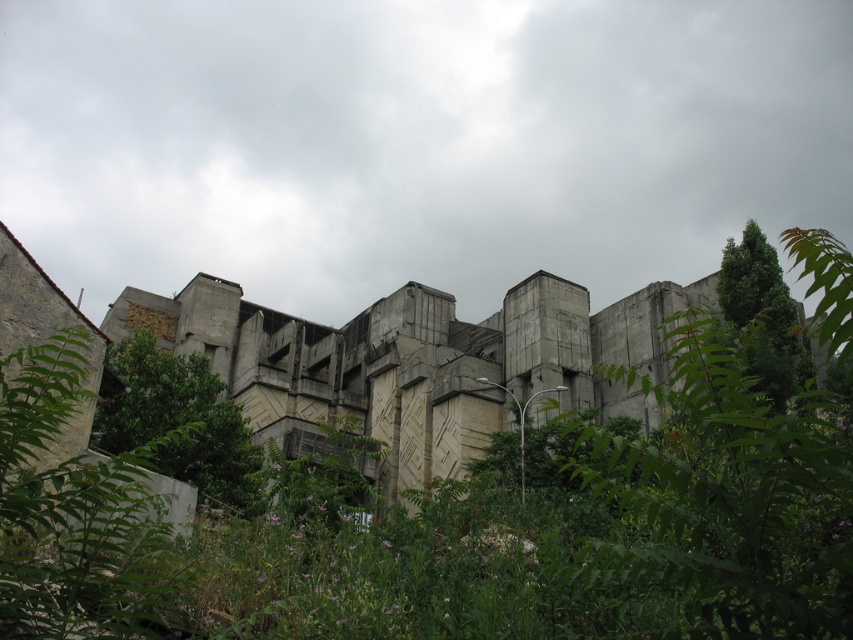
You are standing in front of the large concrete structure and notice two points marked on the image. The first point is at coordinates point (x=181, y=387) and the second is at point (x=766, y=378). Which of these points is nearer to your current position?

Point (x=181, y=387) is closer to the viewer than point (x=766, y=378), so the first point is nearer to your current position.

You are standing in front of the large concrete building and want to take a photo that includes both the green leafy tree at lower left and the green leafy tree at center. Which tree should you position closer to the front of the photo to ensure both are visible?

You should position the green leafy tree at lower left closer to the front of the photo because it is shorter than the green leafy tree at center, allowing both to be visible in the frame.

You are standing at the center of the image. Which direction should you move to reach the green leafy tree at lower left?

You should move to the lower left direction to reach the green leafy tree at lower left.